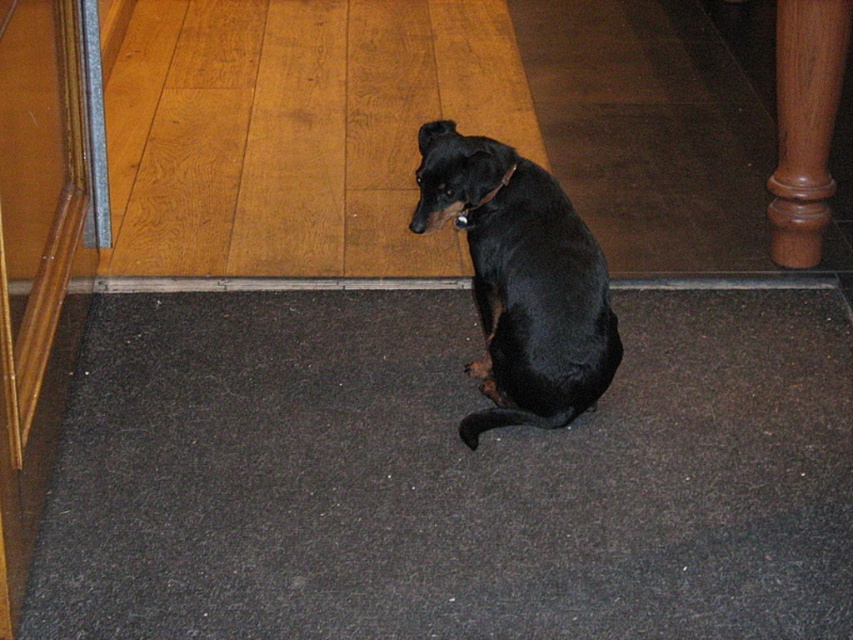
Question: Which object appears closest to the camera in this image?

Choices:
 (A) brown leather neckband at center
 (B) black smooth dog at center

Answer: (B)

Question: Which point appears farthest from the camera in this image?

Choices:
 (A) (509, 176)
 (B) (492, 403)

Answer: (B)

Question: Is black smooth dog at center above brown leather neckband at center?

Choices:
 (A) no
 (B) yes

Answer: (A)

Question: Is black smooth dog at center to the left of brown leather neckband at center from the viewer's perspective?

Choices:
 (A) no
 (B) yes

Answer: (A)

Question: Does black smooth dog at center have a larger size compared to brown leather neckband at center?

Choices:
 (A) yes
 (B) no

Answer: (A)

Question: Which object is farther from the camera taking this photo?

Choices:
 (A) brown leather neckband at center
 (B) black smooth dog at center

Answer: (A)